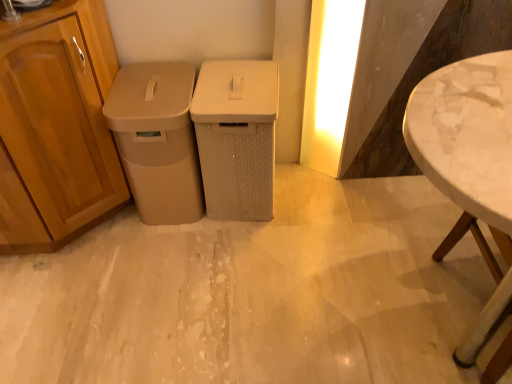
Question: Is beige textured waste bin at center, positioned as the 1th waste container in right-to-left order, smaller than beige matte trash can at left, positioned as the first waste container in left-to-right order?

Choices:
 (A) no
 (B) yes

Answer: (B)

Question: From the image's perspective, is beige textured waste bin at center, positioned as the 1th waste container in right-to-left order, on top of beige matte trash can at left, positioned as the first waste container in left-to-right order?

Choices:
 (A) no
 (B) yes

Answer: (B)

Question: Is beige textured waste bin at center, positioned as the 1th waste container in right-to-left order, outside beige matte trash can at left, which appears as the 2th waste container when viewed from the right?

Choices:
 (A) yes
 (B) no

Answer: (A)

Question: Considering the relative sizes of beige textured waste bin at center, which appears as the second waste container when viewed from the left, and beige matte trash can at left, positioned as the first waste container in left-to-right order, in the image provided, is beige textured waste bin at center, which appears as the second waste container when viewed from the left, shorter than beige matte trash can at left, positioned as the first waste container in left-to-right order,?

Choices:
 (A) no
 (B) yes

Answer: (B)

Question: From a real-world perspective, is beige textured waste bin at center, positioned as the 1th waste container in right-to-left order, physically above beige matte trash can at left, which appears as the 2th waste container when viewed from the right?

Choices:
 (A) no
 (B) yes

Answer: (A)

Question: Is beige textured waste bin at center, which appears as the second waste container when viewed from the left, positioned with its back to beige matte trash can at left, which appears as the 2th waste container when viewed from the right?

Choices:
 (A) no
 (B) yes

Answer: (A)

Question: Considering the relative sizes of yellow matte light at upper right and beige matte trash can at left, which appears as the 2th waste container when viewed from the right, in the image provided, is yellow matte light at upper right wider than beige matte trash can at left, which appears as the 2th waste container when viewed from the right,?

Choices:
 (A) yes
 (B) no

Answer: (B)

Question: From a real-world perspective, is yellow matte light at upper right located higher than beige matte trash can at left, which appears as the 2th waste container when viewed from the right?

Choices:
 (A) yes
 (B) no

Answer: (A)

Question: Is yellow matte light at upper right facing towards beige matte trash can at left, positioned as the first waste container in left-to-right order?

Choices:
 (A) no
 (B) yes

Answer: (A)

Question: Would you say yellow matte light at upper right is outside beige matte trash can at left, positioned as the first waste container in left-to-right order?

Choices:
 (A) yes
 (B) no

Answer: (A)

Question: Is yellow matte light at upper right surrounding beige matte trash can at left, positioned as the first waste container in left-to-right order?

Choices:
 (A) no
 (B) yes

Answer: (A)

Question: From a real-world perspective, does yellow matte light at upper right sit lower than beige matte trash can at left, which appears as the 2th waste container when viewed from the right?

Choices:
 (A) no
 (B) yes

Answer: (A)

Question: Could you tell me if beige textured waste bin at center, positioned as the 1th waste container in right-to-left order, is facing white marble table at right?

Choices:
 (A) yes
 (B) no

Answer: (B)